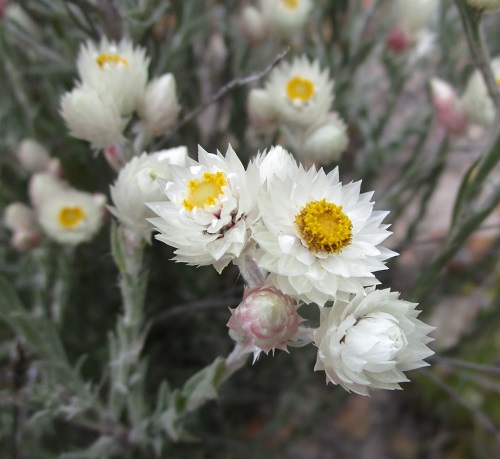
Image resolution: width=500 pixels, height=459 pixels. What are the coordinates of `plant` in the screenshot? It's located at (300, 302).